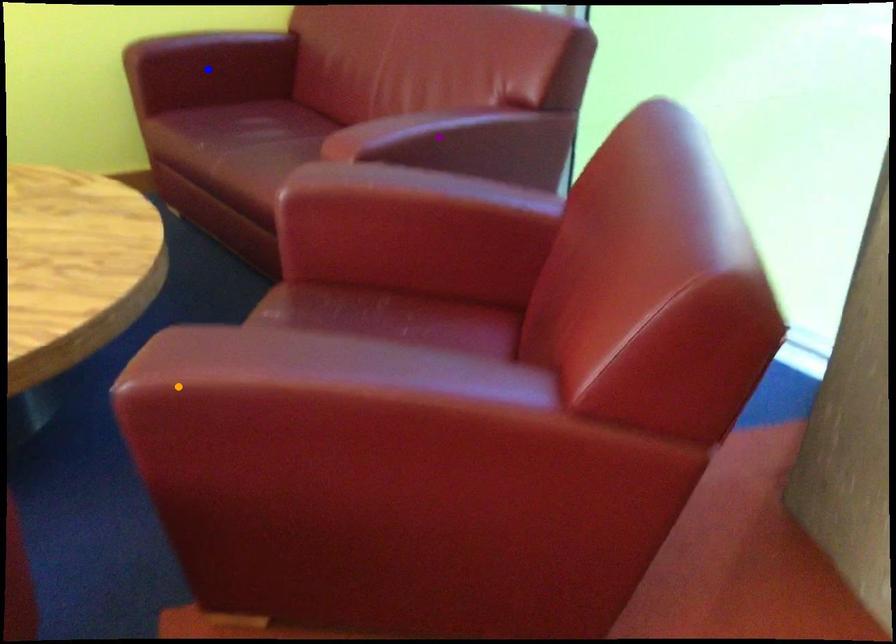
Looking at this image, order these from farthest to nearest:
- orange point
- purple point
- blue point

blue point
purple point
orange point